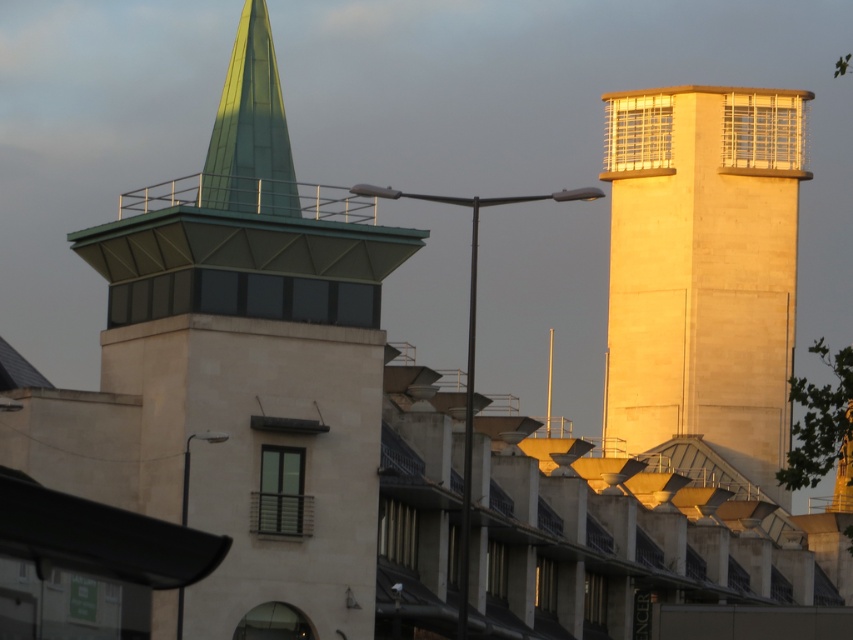
Is beige stone tower at right positioned behind green glass spire at upper left?

Yes, it is behind green glass spire at upper left.

Which is above, beige stone tower at right or green glass spire at upper left?

green glass spire at upper left is higher up.

Measure the distance between beige stone tower at right and camera.

193.54 meters

This screenshot has width=853, height=640. I want to click on beige stone tower at right, so click(x=704, y=268).

Who is shorter, green stone tower at upper left or green glass spire at upper left?

Standing shorter between the two is green glass spire at upper left.

Which is below, green stone tower at upper left or green glass spire at upper left?

green stone tower at upper left is below.

Find the location of a particular element. green stone tower at upper left is located at coordinates (254, 369).

Between green stone tower at upper left and beige stone tower at right, which one appears on the right side from the viewer's perspective?

Positioned to the right is beige stone tower at right.

Does green stone tower at upper left have a lesser height compared to beige stone tower at right?

Correct, green stone tower at upper left is not as tall as beige stone tower at right.

You are a GUI agent. You are given a task and a screenshot of the screen. Output one action in this format:
    pyautogui.click(x=<x>, y=<y>)
    Task: Click on the green stone tower at upper left
    This screenshot has height=640, width=853.
    Given the screenshot: What is the action you would take?
    pyautogui.click(x=254, y=369)